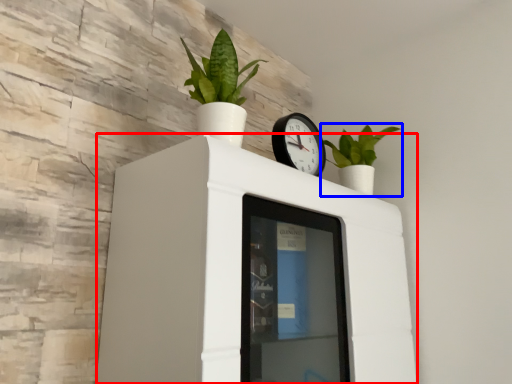
Question: Which object appears farthest to the camera in this image, furniture (highlighted by a red box) or houseplant (highlighted by a blue box)?

Choices:
 (A) furniture
 (B) houseplant

Answer: (B)